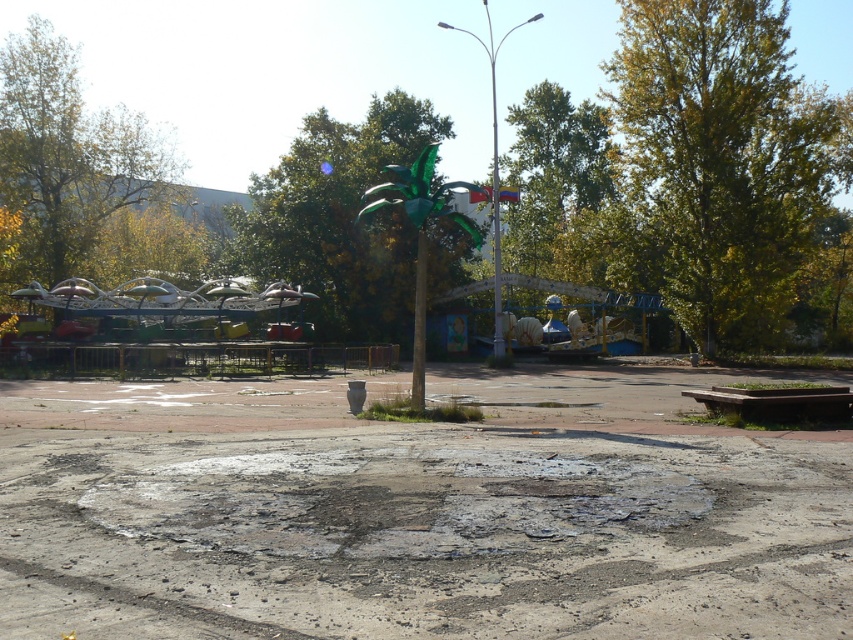
Question: In this image, where is concrete pavement at center located relative to green leafy tree at upper center?

Choices:
 (A) below
 (B) above

Answer: (A)

Question: Among these points, which one is farthest from the camera?

Choices:
 (A) (715, 193)
 (B) (581, 470)
 (C) (77, 278)
 (D) (337, 129)

Answer: (D)

Question: Is green leafy tree at upper right closer to camera compared to green leafy tree at left?

Choices:
 (A) yes
 (B) no

Answer: (B)

Question: Does green metallic tree at center have a lesser width compared to green leafy tree at left?

Choices:
 (A) no
 (B) yes

Answer: (B)

Question: Estimate the real-world distances between objects in this image. Which object is farther from the green metallic tree at center?

Choices:
 (A) green leafy tree at upper center
 (B) metallic shiny carousel at left
 (C) green leafy tree at upper right

Answer: (C)

Question: Which point is farther from the camera taking this photo?

Choices:
 (A) (50, 177)
 (B) (824, 96)
 (C) (567, 193)

Answer: (B)